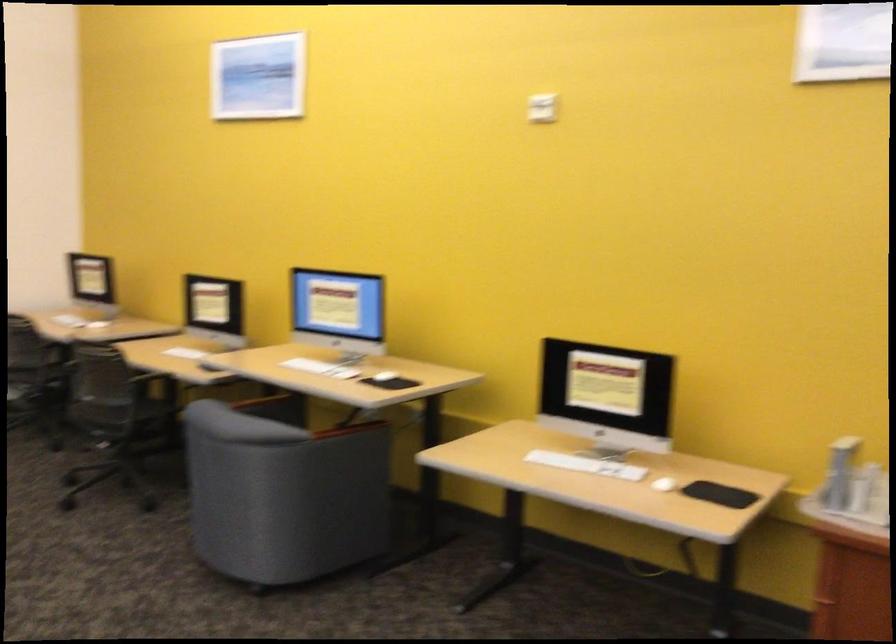
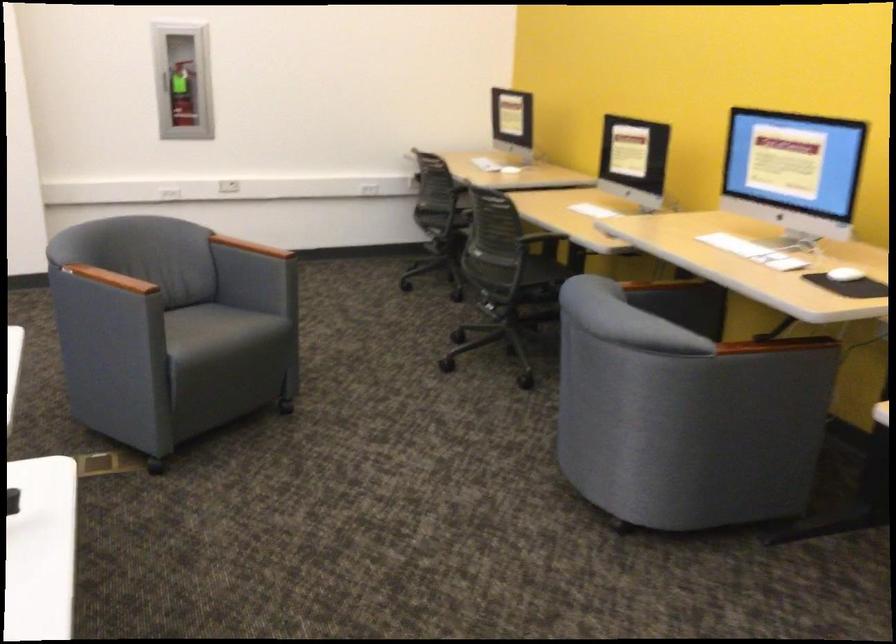
Question: How did the camera likely rotate?

Choices:
 (A) Left
 (B) Right
 (C) Up
 (D) Down

Answer: (A)